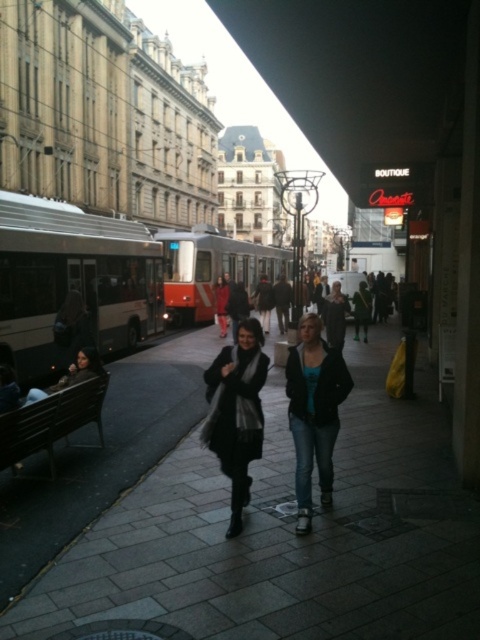
Which is in front, point (298, 552) or point (310, 509)?

Positioned in front is point (298, 552).

Can you confirm if dark gray paving stones at center is positioned above jeans at center?

Incorrect, dark gray paving stones at center is not positioned above jeans at center.

What do you see at coordinates (285, 536) in the screenshot? I see `dark gray paving stones at center` at bounding box center [285, 536].

Image resolution: width=480 pixels, height=640 pixels. What are the coordinates of `dark gray paving stones at center` in the screenshot? It's located at (285, 536).

Does dark gray paving stones at center have a lesser width compared to dark blue jeans at center?

No, dark gray paving stones at center is not thinner than dark blue jeans at center.

Between dark gray paving stones at center and dark blue jeans at center, which one is positioned lower?

dark gray paving stones at center is lower down.

Does point (365, 444) come farther from viewer compared to point (365, 292)?

No.

Identify the location of dark gray paving stones at center. This screenshot has width=480, height=640. (285, 536).

Which of these two, jeans at center or black wool scarf at center, stands taller?

jeans at center is taller.

Is jeans at center above black wool scarf at center?

Correct, jeans at center is located above black wool scarf at center.

At what (x,y) coordinates should I click in order to perform the action: click on jeans at center. Please return your answer as a coordinate pair (x, y). The height and width of the screenshot is (640, 480). Looking at the image, I should click on (313, 412).

What are the coordinates of `jeans at center` in the screenshot? It's located at coord(313,412).